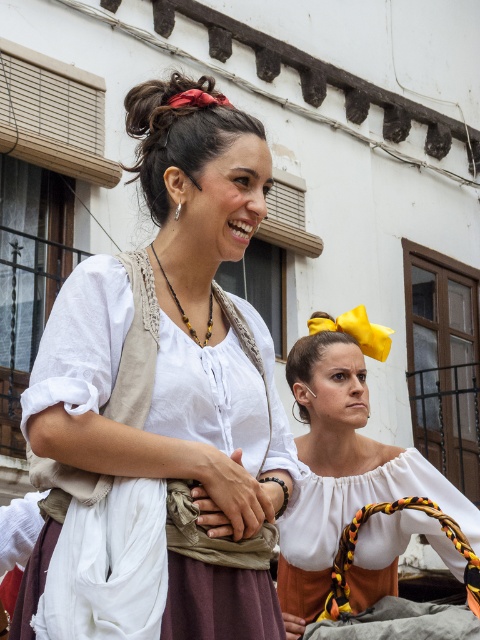
Question: Which point is farther to the camera?

Choices:
 (A) coord(364,483)
 (B) coord(157,273)

Answer: (A)

Question: Considering the relative positions of white cotton blouse at center and matte white blouse at center in the image provided, where is white cotton blouse at center located with respect to matte white blouse at center?

Choices:
 (A) left
 (B) right

Answer: (A)

Question: Is white cotton blouse at center below matte white blouse at center?

Choices:
 (A) no
 (B) yes

Answer: (A)

Question: Which of the following is the farthest from the observer?

Choices:
 (A) white cotton blouse at center
 (B) matte white blouse at center

Answer: (B)

Question: Does white cotton blouse at center appear on the right side of matte white blouse at center?

Choices:
 (A) yes
 (B) no

Answer: (B)